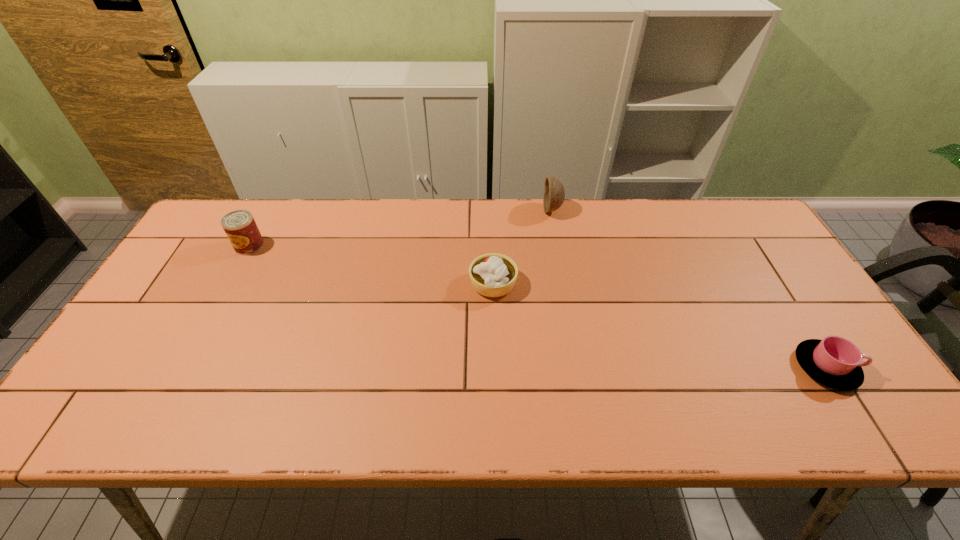
This screenshot has height=540, width=960. Find the location of `unoccupied area between the farthest object and the rightmost object`. unoccupied area between the farthest object and the rightmost object is located at coordinates pos(688,289).

Locate an element on the screen. free space between the second nearest object and the third nearest object is located at coordinates (372, 265).

Where is `object that ranks as the second closest to the farthest object`? This screenshot has height=540, width=960. object that ranks as the second closest to the farthest object is located at coordinates (835, 362).

Identify which object is located as the second nearest to the bowl. Please provide its 2D coordinates. Your answer should be formatted as a tuple, i.e. [(x, y)], where the tuple contains the x and y coordinates of a point satisfying the conditions above.

[(835, 362)]

You are a GUI agent. You are given a task and a screenshot of the screen. Output one action in this format:
    pyautogui.click(x=<x>, y=<y>)
    Task: Click on the free space in the image that satisfies the following two spatial constraints: 1. on the back side of the whipped cream; 2. on the right side of the bowl
    Image resolution: width=960 pixels, height=540 pixels.
    Given the screenshot: What is the action you would take?
    pyautogui.click(x=491, y=210)